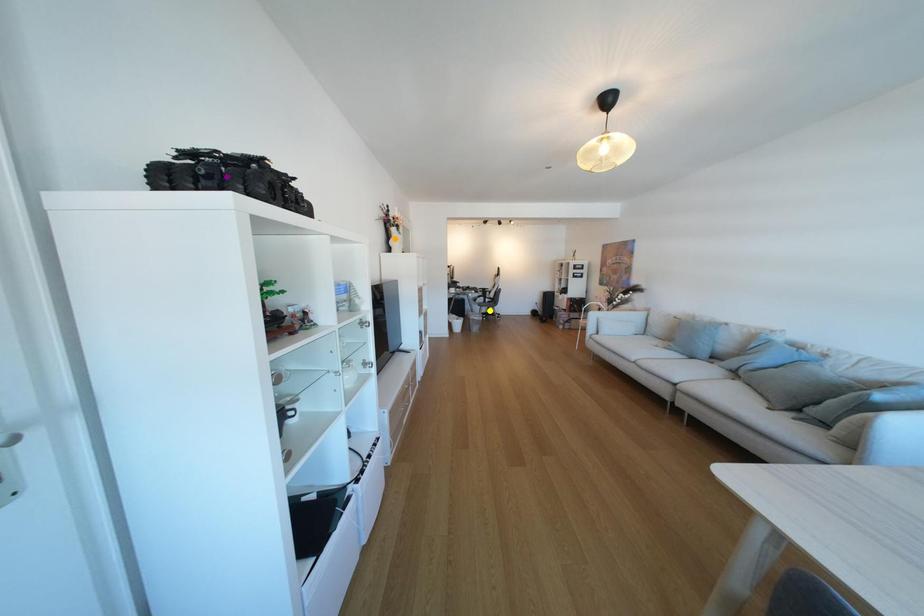
Order these from nearest to farthest:
purple point, orange point, yellow point

yellow point → orange point → purple point